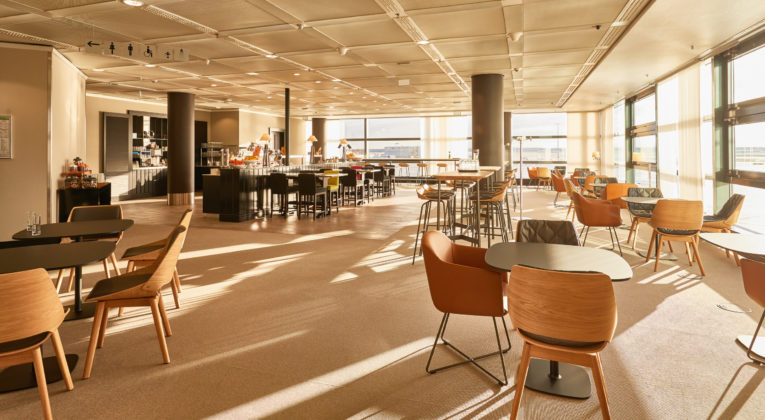
I want to click on table, so click(70, 255), click(76, 231), click(519, 257), click(739, 246), click(646, 201), click(599, 185), click(474, 177), click(495, 168).